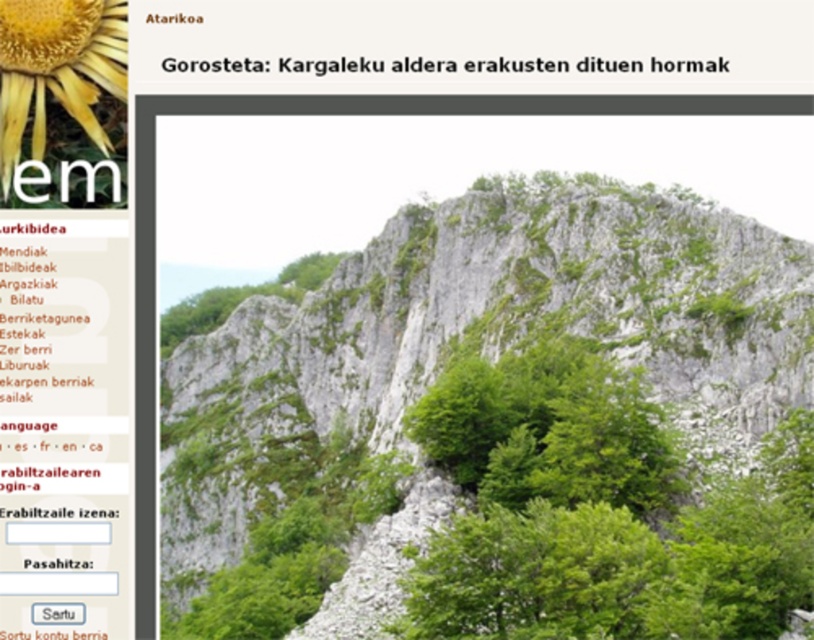
Question: Can you confirm if yellow matte flower at upper left is positioned below green leafy trees at upper center?

Choices:
 (A) yes
 (B) no

Answer: (A)

Question: Among these points, which one is nearest to the camera?

Choices:
 (A) (117, 93)
 (B) (720, 67)

Answer: (A)

Question: Can you confirm if yellow matte flower at upper left is positioned above green leafy trees at upper center?

Choices:
 (A) yes
 (B) no

Answer: (B)

Question: Which object appears farthest from the camera in this image?

Choices:
 (A) yellow matte flower at upper left
 (B) green leafy trees at center

Answer: (B)

Question: Does green leafy trees at center appear over green leafy trees at upper center?

Choices:
 (A) no
 (B) yes

Answer: (A)

Question: Estimate the real-world distances between objects in this image. Which object is closer to the green leafy trees at center?

Choices:
 (A) green leafy trees at upper center
 (B) yellow matte flower at upper left

Answer: (A)